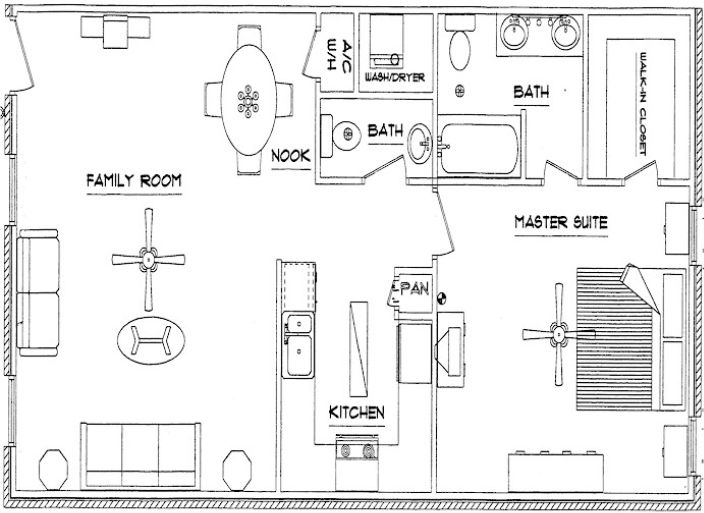
This screenshot has height=513, width=704. I want to click on sink, so click(x=513, y=39), click(x=567, y=38), click(x=348, y=132), click(x=301, y=324), click(x=301, y=343).